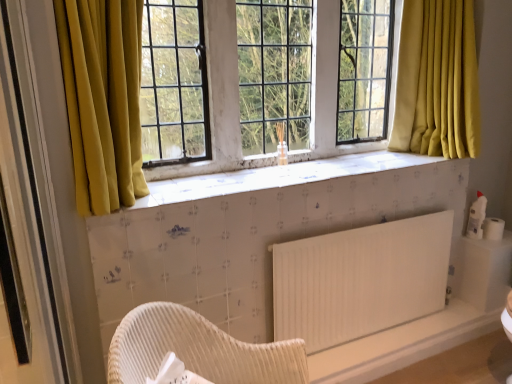
At what (x,y) coordinates should I click in order to perform the action: click on free space underneath white matte radiator at lower right (from a real-world perspective). Please return your answer as a coordinate pair (x, y). Looking at the image, I should click on (388, 326).